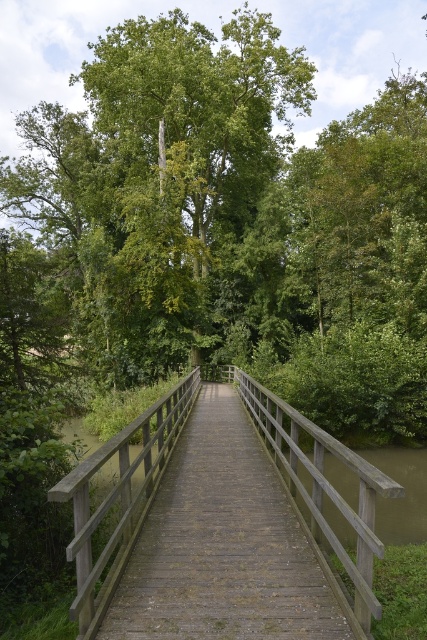
You are standing on the wooden bridge at center and looking towards the green leafy tree at center. Which object is closer to you?

The green leafy tree at center is closer to you than the wooden bridge at center because it is positioned further to the viewer.

You are standing on the wooden bridge at center and looking towards the green leafy tree at center. Which direction should you walk to reach the tree?

The green leafy tree at center is to the left of the wooden bridge at center, so you should walk towards the left to reach the tree.

You are standing on the wooden bridge and want to move from point A to point B. Point A is located at coordinates point (412,394) and point B is at point (286,483). If you walk straight towards point B from point A, will you be moving forward along the bridge or going backward away from the bridge?

Since point (412,394) is behind point (286,483), walking straight towards point B from point A would mean you are moving backward away from the bridge.